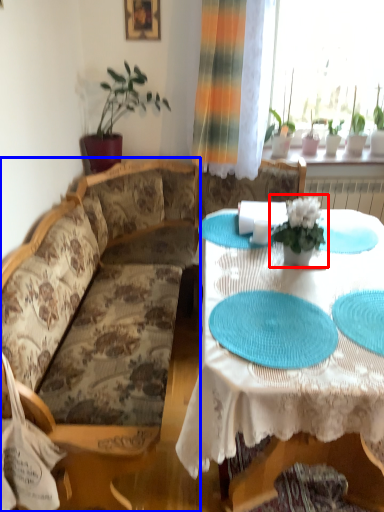
Question: Which of the following is the closest to the observer, houseplant (highlighted by a red box) or studio couch (highlighted by a blue box)?

Choices:
 (A) houseplant
 (B) studio couch

Answer: (B)